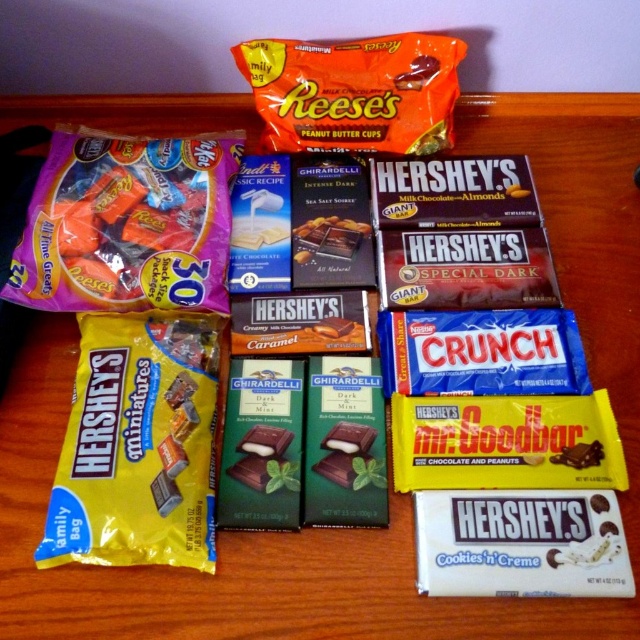
You are a customer looking at the display of candies and chocolates on the wooden surface. There are two points marked on the display, one at coordinates point (410, 116) and another at point (244, 435). Which of these points is closer to you as you view the display?

Point (410, 116) is further to the camera than point (244, 435), so the point closer to you is point (244, 435).

You are a customer at a candy store and want to pick up the item located at point (160, 268) and then the item at point (288, 438). Given that you can only move forward in a straight line, will you be able to reach the second point without moving backward?

Point (160, 268) is behind point (288, 438), so yes, you can reach the second point by moving forward in a straight line from the first point to the second point.